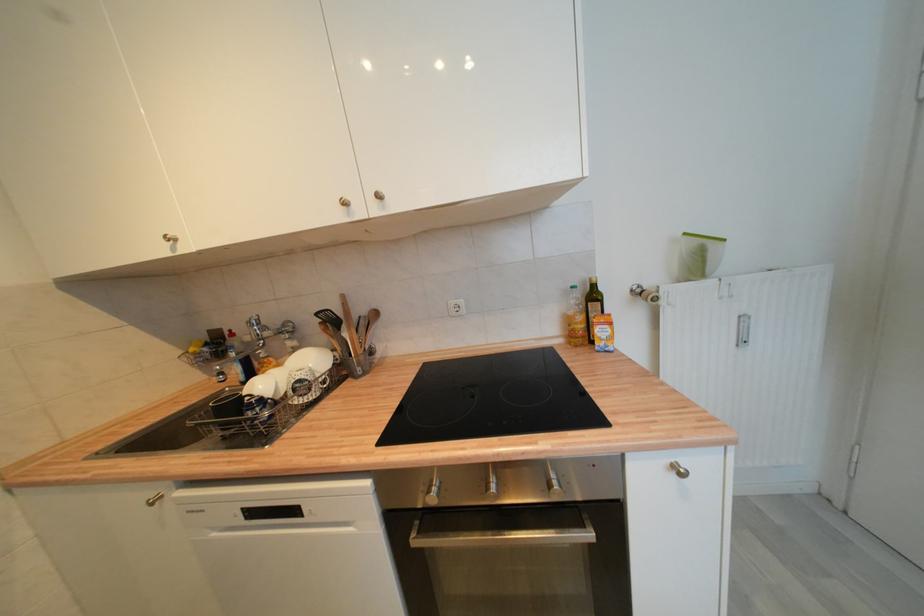
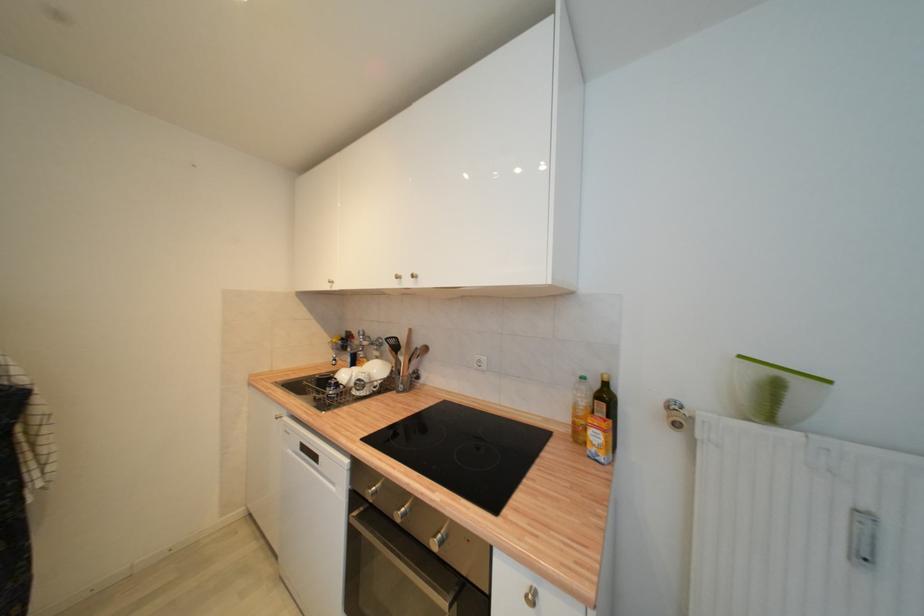
Locate, in the second image, the point that corresponds to pixel 494 490 in the first image.

(405, 512)